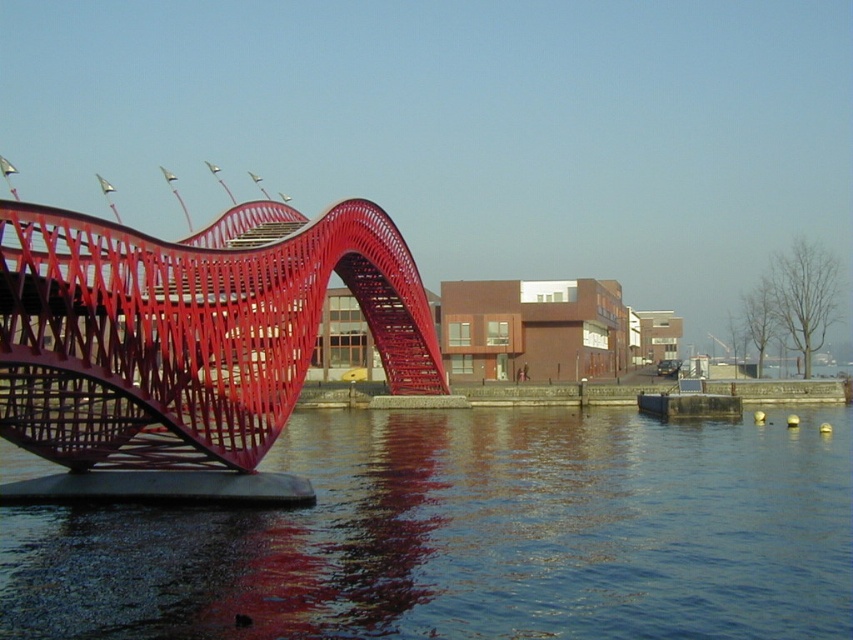
Looking at this image, is glossy water at lower left shorter than metallic red bridge at left?

Correct, glossy water at lower left is not as tall as metallic red bridge at left.

Is point (811, 504) positioned behind point (160, 323)?

Yes, it is.

Which is behind, point (495, 529) or point (170, 408)?

The point (495, 529) is more distant.

The image size is (853, 640). Identify the location of glossy water at lower left. (469, 536).